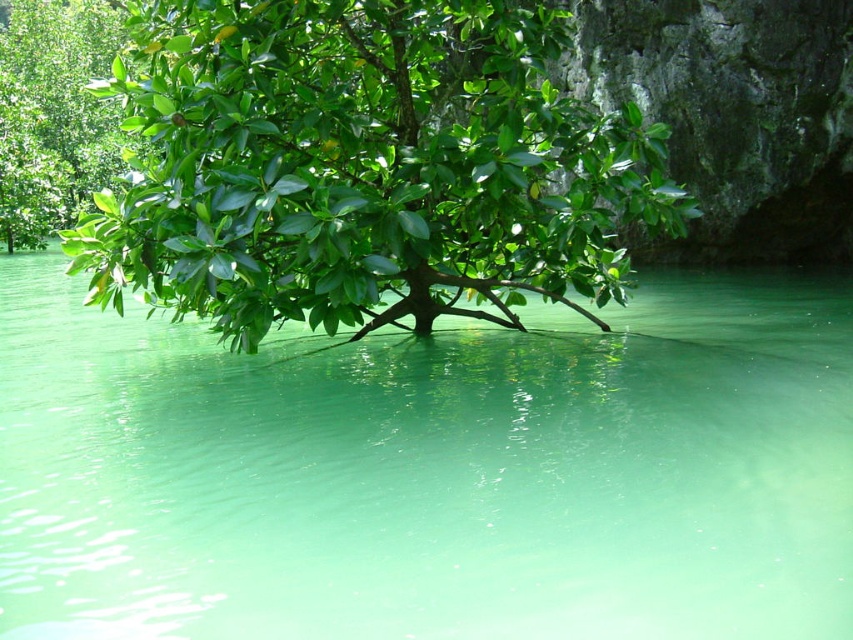
Question: Among these points, which one is farthest from the camera?

Choices:
 (A) (267, 58)
 (B) (837, 461)
 (C) (27, 236)

Answer: (C)

Question: Can you confirm if green translucent water at center is smaller than green glossy tree at center?

Choices:
 (A) yes
 (B) no

Answer: (A)

Question: Considering the relative positions of green translucent water at center and green leafy tree at upper left in the image provided, where is green translucent water at center located with respect to green leafy tree at upper left?

Choices:
 (A) below
 (B) above

Answer: (A)

Question: Which object appears closest to the camera in this image?

Choices:
 (A) green leafy tree at upper left
 (B) green translucent water at center
 (C) green glossy tree at center

Answer: (B)

Question: Which object appears farthest from the camera in this image?

Choices:
 (A) green leafy tree at upper left
 (B) green translucent water at center

Answer: (A)

Question: Can you confirm if green translucent water at center is positioned to the left of green leafy tree at upper left?

Choices:
 (A) no
 (B) yes

Answer: (A)